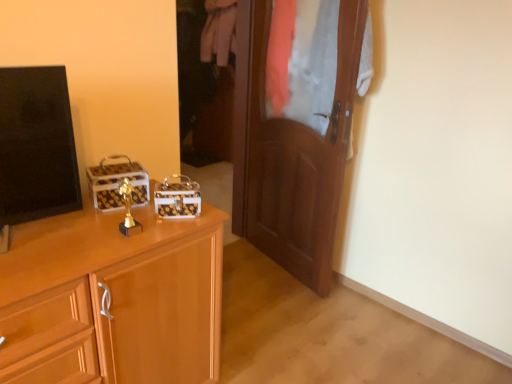
Question: Can you confirm if matte wood cabinet at left is wider than black glossy tv at left?

Choices:
 (A) no
 (B) yes

Answer: (B)

Question: From the image's perspective, is matte wood cabinet at left on top of black glossy tv at left?

Choices:
 (A) yes
 (B) no

Answer: (B)

Question: Does matte wood cabinet at left lie in front of black glossy tv at left?

Choices:
 (A) no
 (B) yes

Answer: (B)

Question: Does matte wood cabinet at left have a greater height compared to black glossy tv at left?

Choices:
 (A) no
 (B) yes

Answer: (B)

Question: Considering the relative sizes of matte wood cabinet at left and black glossy tv at left in the image provided, is matte wood cabinet at left shorter than black glossy tv at left?

Choices:
 (A) yes
 (B) no

Answer: (B)

Question: Looking at their shapes, would you say black glossy tv at left is wider or thinner than matte wood cabinet at left?

Choices:
 (A) wide
 (B) thin

Answer: (B)

Question: Based on their sizes in the image, would you say black glossy tv at left is bigger or smaller than matte wood cabinet at left?

Choices:
 (A) small
 (B) big

Answer: (A)

Question: Is point click(56, 92) positioned closer to the camera than point click(56, 259)?

Choices:
 (A) closer
 (B) farther

Answer: (B)

Question: Considering the relative positions of black glossy tv at left and matte wood cabinet at left in the image provided, is black glossy tv at left to the left or to the right of matte wood cabinet at left?

Choices:
 (A) left
 (B) right

Answer: (A)

Question: Is black glossy tv at left wider or thinner than wooden door at center?

Choices:
 (A) wide
 (B) thin

Answer: (A)

Question: Do you think black glossy tv at left is within wooden door at center, or outside of it?

Choices:
 (A) outside
 (B) inside

Answer: (A)

Question: Considering their positions, is black glossy tv at left located in front of or behind wooden door at center?

Choices:
 (A) front
 (B) behind

Answer: (A)

Question: In terms of size, does black glossy tv at left appear bigger or smaller than wooden door at center?

Choices:
 (A) small
 (B) big

Answer: (A)

Question: Is white cotton pants at center bigger or smaller than black glossy tv at left?

Choices:
 (A) small
 (B) big

Answer: (B)

Question: From a real-world perspective, is white cotton pants at center above or below black glossy tv at left?

Choices:
 (A) below
 (B) above

Answer: (B)